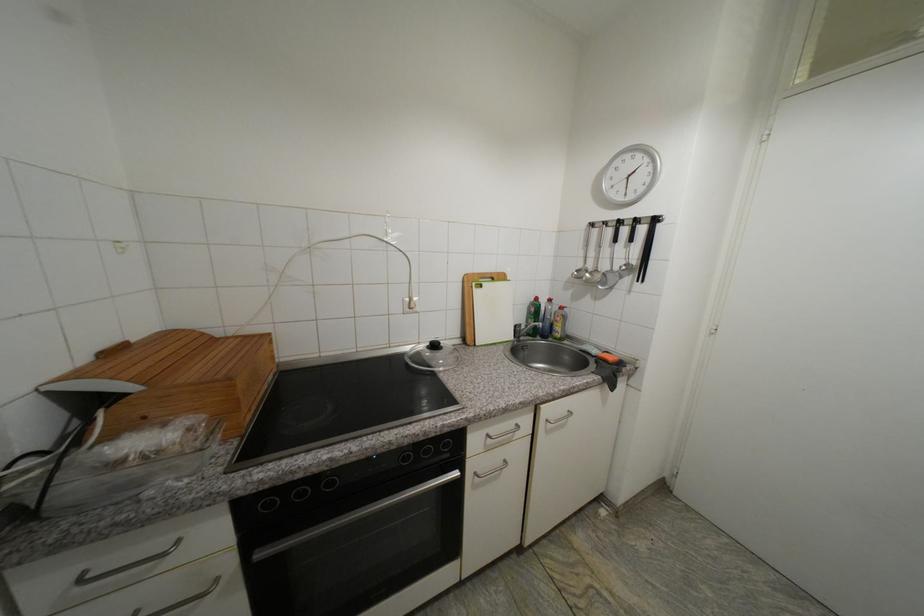
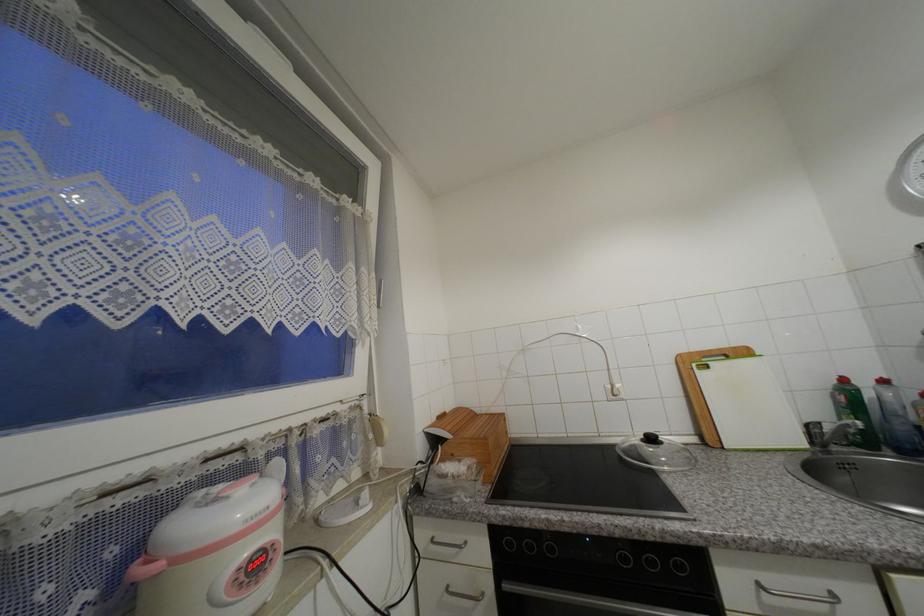
Where in the second image is the point corresponding to pixel 524 427 from the first image?

(840, 597)